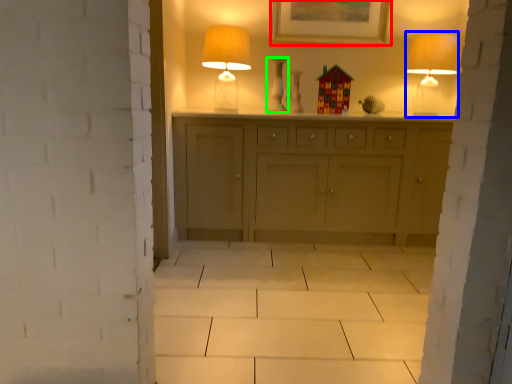
Question: Estimate the real-world distances between objects in this image. Which object is farther from picture frame (highlighted by a red box), table lamp (highlighted by a blue box) or vase (highlighted by a green box)?

Choices:
 (A) table lamp
 (B) vase

Answer: (A)